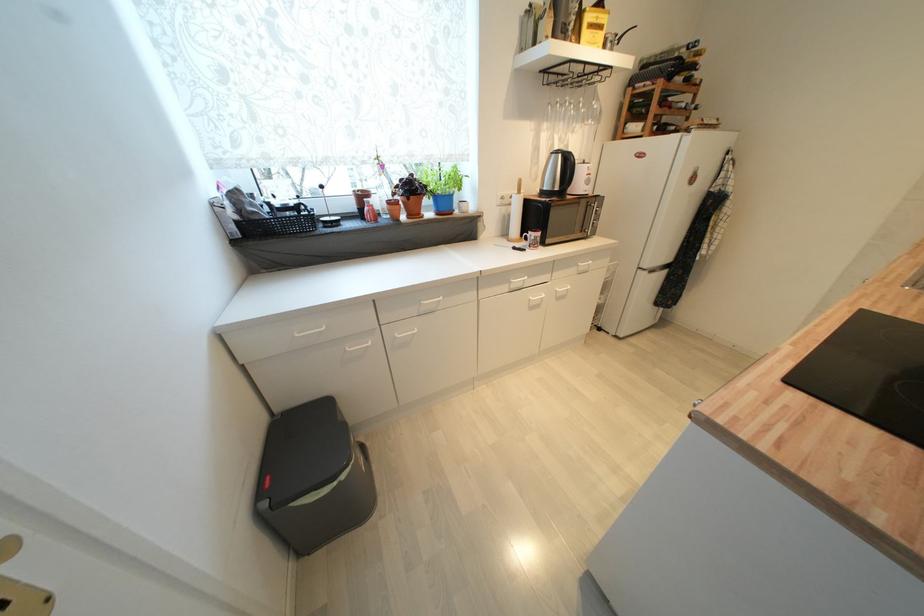
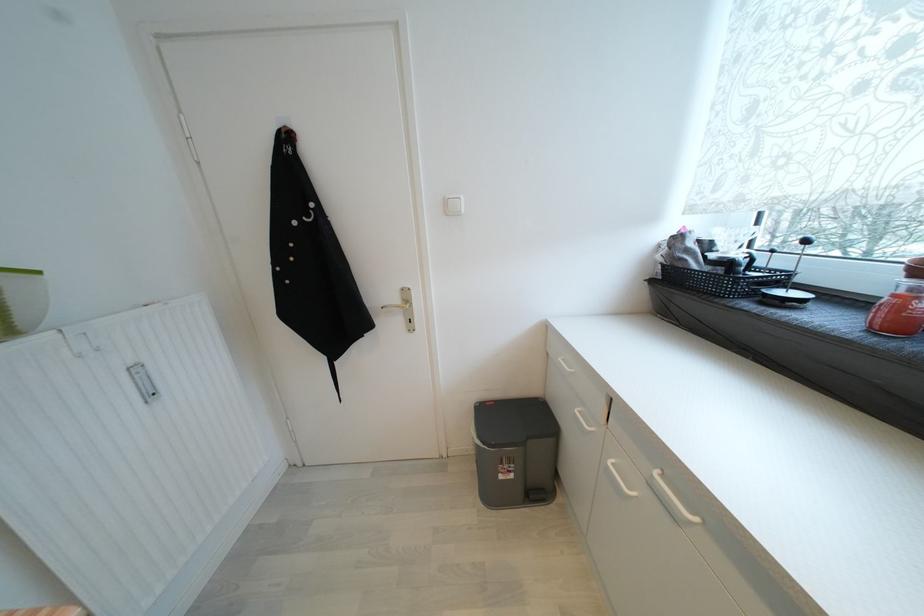
The images are taken continuously from a first-person perspective. In which direction is your viewpoint rotating?

The camera rotated toward left-down.